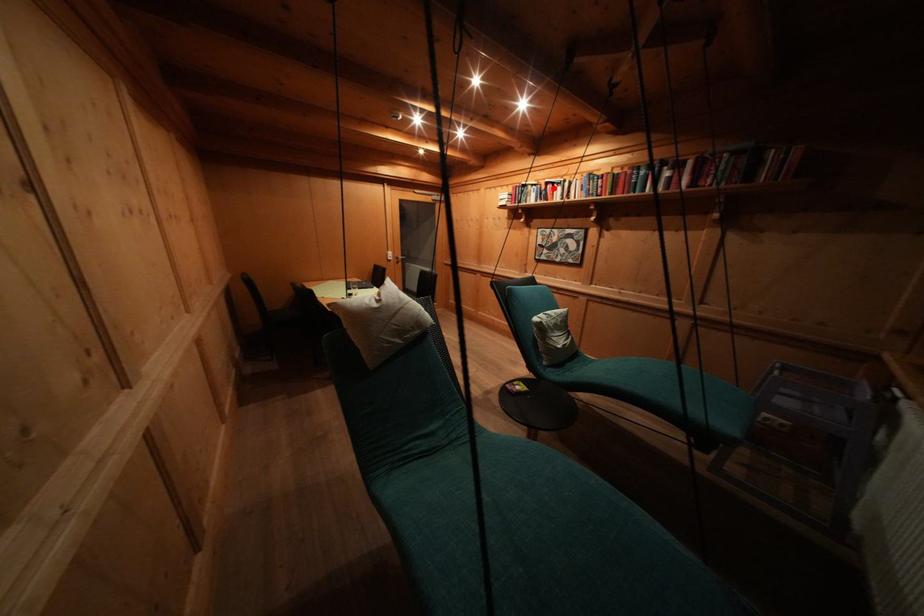
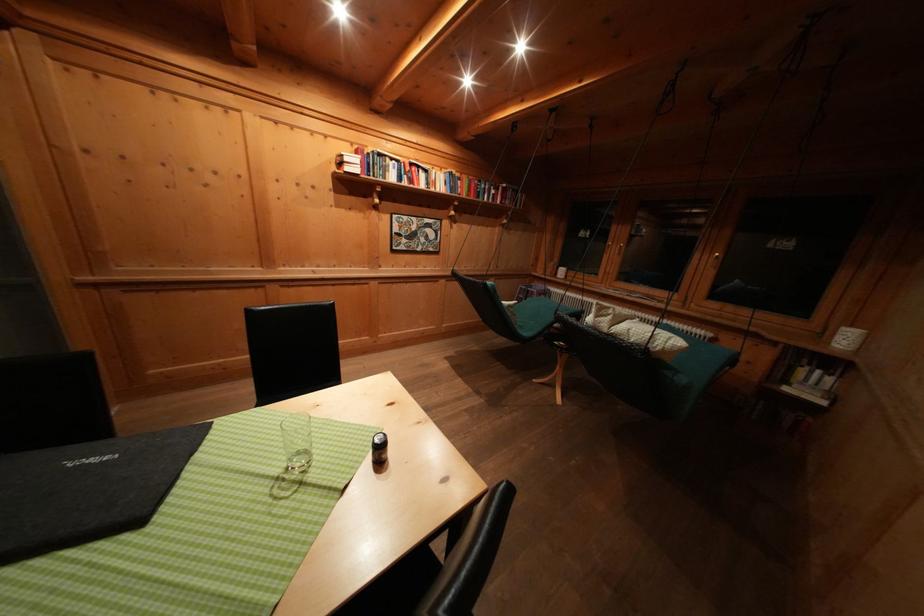
Question: I am providing you with two images of the same scene from different viewpoints. Given a red point in image1, look at the same physical point in image2. Is it:

Choices:
 (A) Closer to the viewpoint
 (B) Farther from the viewpoint

Answer: (B)